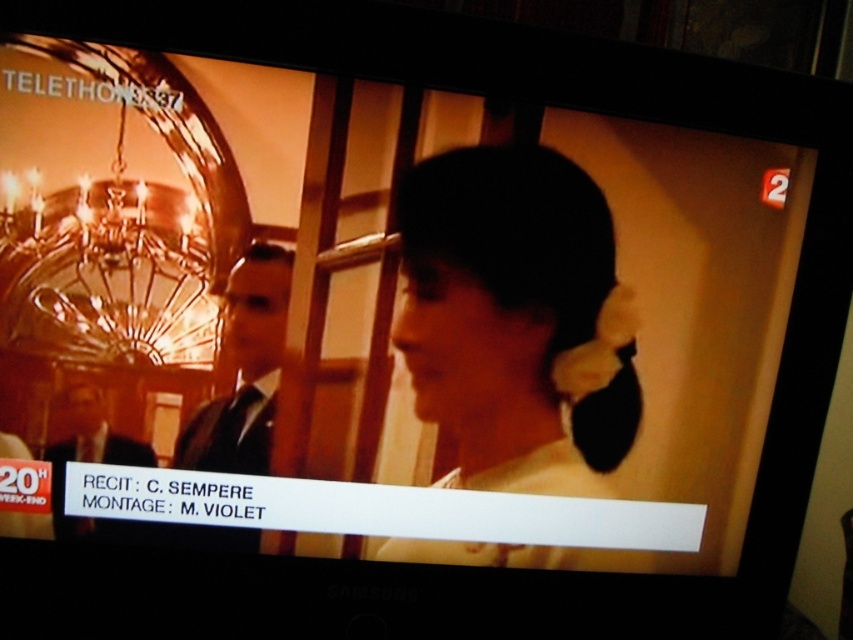
You are a camera operator adjusting the focus of your lens. You need to focus on both the point at [480,273] and the point at [79,392]. Since depth of field is limited, which point should you prioritize focusing on to ensure the closer one is sharp?

You should prioritize focusing on point [79,392] because it is closer to the viewer than point [480,273], ensuring it remains sharp within the limited depth of field.

You are a photographer trying to capture both the black suit at center and the dark suit at lower left in a single frame. Based on their positions, which one should you focus on first to ensure both are in the shot?

The black suit at center is positioned on the right side of dark suit at lower left, so focusing on the dark suit at lower left first would allow you to frame the shot to include both.